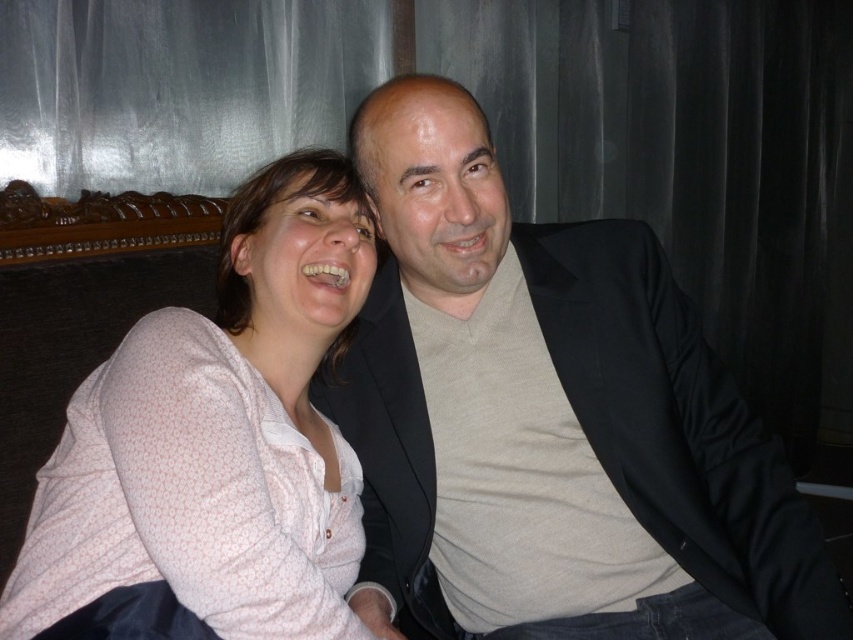
Does matte black suit at center have a lesser height compared to white dotted shirt at upper left?

Incorrect, matte black suit at center's height does not fall short of white dotted shirt at upper left's.

The image size is (853, 640). Describe the element at coordinates (549, 419) in the screenshot. I see `matte black suit at center` at that location.

Who is more distant from viewer, (375, 456) or (287, 442)?

The point (375, 456) is more distant.

At what (x,y) coordinates should I click in order to perform the action: click on matte black suit at center. Please return your answer as a coordinate pair (x, y). The width and height of the screenshot is (853, 640). Looking at the image, I should click on (549, 419).